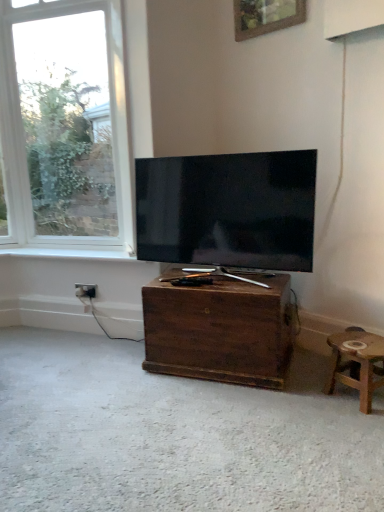
This screenshot has height=512, width=384. What do you see at coordinates (266, 16) in the screenshot? I see `wooden picture frame at upper center` at bounding box center [266, 16].

The height and width of the screenshot is (512, 384). Identify the location of matte black tv at center. (228, 210).

Describe the element at coordinates (228, 210) in the screenshot. This screenshot has width=384, height=512. I see `matte black tv at center` at that location.

Where is `white wood window sill at lower left`? white wood window sill at lower left is located at coordinates (69, 254).

Would you say white wood window sill at lower left is a long distance from matte black tv at center?

Actually, white wood window sill at lower left and matte black tv at center are a little close together.

Between white wood window sill at lower left and matte black tv at center, which one appears on the right side from the viewer's perspective?

matte black tv at center.

Is white wood window sill at lower left looking in the opposite direction of matte black tv at center?

white wood window sill at lower left is not turned away from matte black tv at center.

Which of these two, black plastic power outlet at lower left or white wood window sill at lower left, is wider?

white wood window sill at lower left is wider.

Consider the image. From the image's perspective, between black plastic power outlet at lower left and white wood window sill at lower left, who is located below?

black plastic power outlet at lower left.

I want to click on window sill on the left of the black plastic power outlet at lower left, so click(69, 254).

Would you say dark wood chest at center is a long distance from black plastic power outlet at lower left?

dark wood chest at center is near black plastic power outlet at lower left, not far away.

Which of these two, dark wood chest at center or black plastic power outlet at lower left, is smaller?

black plastic power outlet at lower left.

From the image's perspective, who appears lower, dark wood chest at center or black plastic power outlet at lower left?

dark wood chest at center is shown below in the image.

Considering the positions of points (77, 286) and (1, 105), is point (77, 286) closer to camera compared to point (1, 105)?

Yes, point (77, 286) is in front of point (1, 105).

Is black plastic power outlet at lower left taller than clear glass window at upper left?

No, black plastic power outlet at lower left is not taller than clear glass window at upper left.

Is black plastic power outlet at lower left not within clear glass window at upper left?

Indeed, black plastic power outlet at lower left is completely outside clear glass window at upper left.

Is black plastic power outlet at lower left not close to clear glass window at upper left?

black plastic power outlet at lower left is far away from clear glass window at upper left.

Which is in front, point (145, 252) or point (123, 253)?

The point (145, 252) is closer.

From the image's perspective, would you say matte black tv at center is shown under white wood window sill at lower left?

Actually, matte black tv at center appears above white wood window sill at lower left in the image.

Where is `window sill that is under the matte black tv at center (from a real-world perspective)`? The image size is (384, 512). window sill that is under the matte black tv at center (from a real-world perspective) is located at coordinates pos(69,254).

In the image, is dark wood chest at center positioned in front of or behind wooden picture frame at upper center?

Visually, dark wood chest at center is located in front of wooden picture frame at upper center.

From the image's perspective, is dark wood chest at center located above or below wooden picture frame at upper center?

dark wood chest at center is below wooden picture frame at upper center.

Is dark wood chest at center completely or partially outside of wooden picture frame at upper center?

That's correct, dark wood chest at center is outside of wooden picture frame at upper center.

From a real-world perspective, is dark wood chest at center under wooden picture frame at upper center?

Indeed, from a real-world perspective, dark wood chest at center is positioned beneath wooden picture frame at upper center.

Who is more distant, black plastic power outlet at lower left or dark wood chest at center?

black plastic power outlet at lower left is further from the camera.

Measure the distance from black plastic power outlet at lower left to dark wood chest at center.

black plastic power outlet at lower left is 93.49 centimeters away from dark wood chest at center.

This screenshot has height=512, width=384. In order to click on power outlet above the dark wood chest at center (from the image's perspective) in this screenshot , I will do `click(86, 290)`.

Find the location of `television to the right of white wood window sill at lower left`. television to the right of white wood window sill at lower left is located at coordinates 228,210.

Image resolution: width=384 pixels, height=512 pixels. I want to click on window sill that is on the left side of black plastic power outlet at lower left, so click(x=69, y=254).

From the image, which object appears to be farther from clear glass window at upper left, wooden stool at lower right or black plastic power outlet at lower left?

wooden stool at lower right is positioned further to the anchor clear glass window at upper left.

Estimate the real-world distances between objects in this image. Which object is further from dark wood chest at center, wooden picture frame at upper center or clear glass window at upper left?

wooden picture frame at upper center is positioned further to the anchor dark wood chest at center.

From the image, which object appears to be farther from dark wood chest at center, matte black tv at center or clear glass window at upper left?

clear glass window at upper left is further to dark wood chest at center.

Based on their spatial positions, is dark wood chest at center or black plastic power outlet at lower left closer to white wood window sill at lower left?

black plastic power outlet at lower left.

Which object lies nearer to the anchor point dark wood chest at center, black plastic power outlet at lower left or wooden picture frame at upper center?

Based on the image, black plastic power outlet at lower left appears to be nearer to dark wood chest at center.

From the image, which object appears to be farther from wooden stool at lower right, dark wood chest at center or white wood window sill at lower left?

white wood window sill at lower left is positioned further to the anchor wooden stool at lower right.

From the image, which object appears to be farther from matte black tv at center, wooden picture frame at upper center or wooden stool at lower right?

The object further to matte black tv at center is wooden picture frame at upper center.

Looking at the image, which one is located closer to wooden stool at lower right, wooden picture frame at upper center or matte black tv at center?

Based on the image, matte black tv at center appears to be nearer to wooden stool at lower right.

Locate an element on the screen. window sill located between clear glass window at upper left and wooden stool at lower right in the left-right direction is located at coordinates (69, 254).

Identify the location of window between wooden picture frame at upper center and black plastic power outlet at lower left in the up-down direction. (63, 128).

Image resolution: width=384 pixels, height=512 pixels. Identify the location of power outlet between white wood window sill at lower left and wooden stool at lower right. (86, 290).

You are a GUI agent. You are given a task and a screenshot of the screen. Output one action in this format:
    pyautogui.click(x=<x>, y=<y>)
    Task: Click on the power outlet situated between white wood window sill at lower left and dark wood chest at center from left to right
    The height and width of the screenshot is (512, 384).
    Given the screenshot: What is the action you would take?
    pyautogui.click(x=86, y=290)